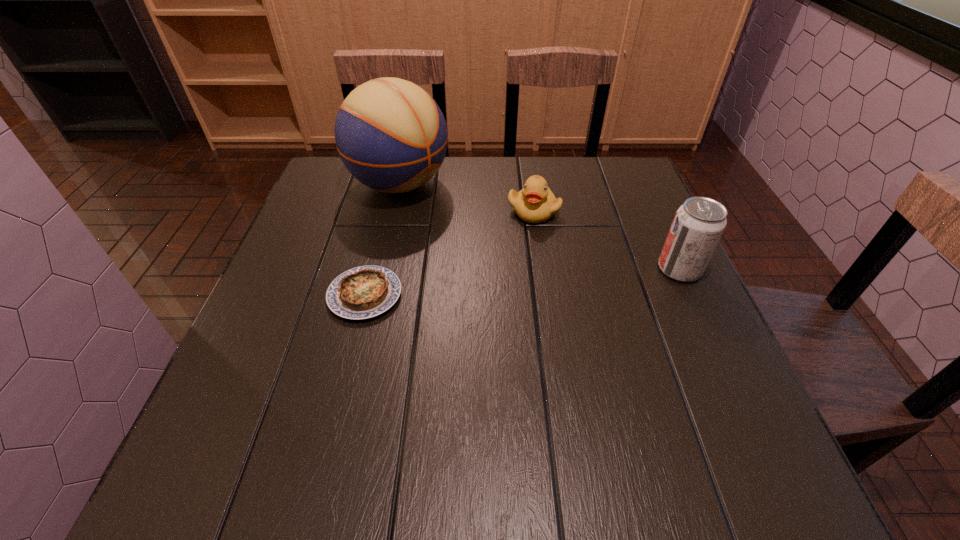
I want to click on vacant area located on the patterned surface of the basketball, so click(503, 247).

Identify the location of free spot located on the beak of the third tallest object. (576, 296).

The width and height of the screenshot is (960, 540). Identify the location of free space located on the beak of the third tallest object. (558, 258).

Where is `vacant space located 0.070m on the beak of the third tallest object`? This screenshot has height=540, width=960. vacant space located 0.070m on the beak of the third tallest object is located at coordinates (550, 244).

Where is `basketball at the far edge`? This screenshot has height=540, width=960. basketball at the far edge is located at coordinates (391, 135).

Identify the location of duckling that is at the far edge. (535, 203).

In order to click on quiche that is at the left edge in this screenshot , I will do `click(363, 292)`.

Find the location of `basketball that is at the left edge`. basketball that is at the left edge is located at coordinates (391, 135).

The image size is (960, 540). What are the coordinates of `object situated at the right edge` in the screenshot? It's located at (699, 223).

Identify the location of object that is at the far left corner. The image size is (960, 540). (391, 135).